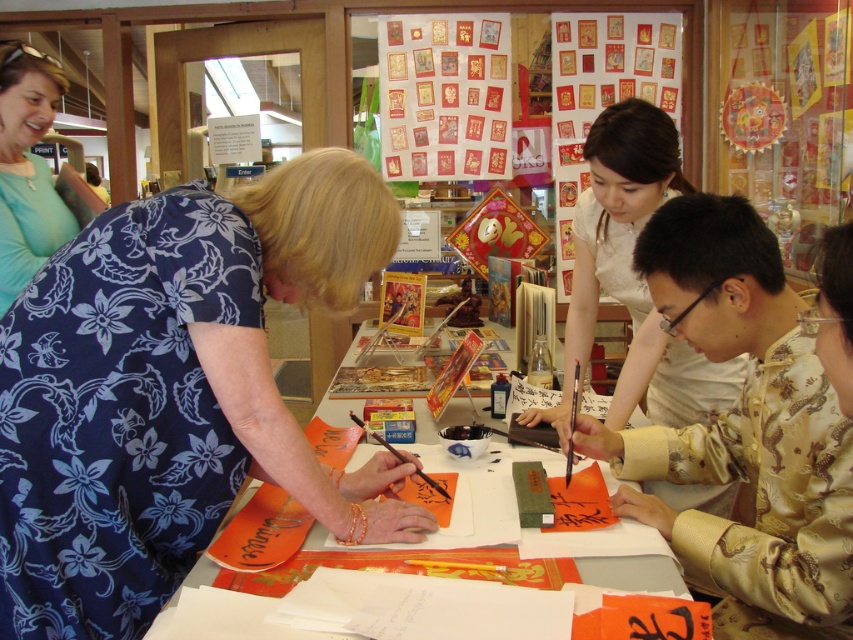
You are standing at the entrance of the event and want to find the person in the blue floral dress at center. According to the coordinates provided, where should you look to find them?

The blue floral dress at center is located at the 2D coordinates point (173, 392), so you should look towards the right side and lower portion of the image to find them.

Where is the gold silk shirt at center located in the image?

The gold silk shirt at center is located at point (743, 432) in the image.